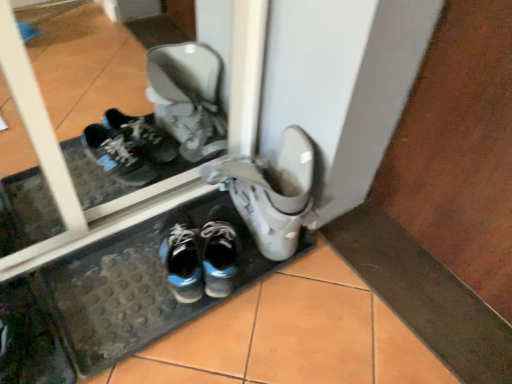
Question: In which direction should I rotate to look at white matte boot at center, which is counted as the first footwear, starting from the right?

Choices:
 (A) left
 (B) right

Answer: (B)

Question: From a real-world perspective, is shiny blue running shoe at center below blue synthetic sneakers at center, positioned as the 2th footwear in right-to-left order?

Choices:
 (A) no
 (B) yes

Answer: (B)

Question: Can you confirm if shiny blue running shoe at center is shorter than blue synthetic sneakers at center, positioned as the 2th footwear in right-to-left order?

Choices:
 (A) no
 (B) yes

Answer: (B)

Question: Are shiny blue running shoe at center and blue synthetic sneakers at center, which is counted as the first footwear, starting from the left, located far from each other?

Choices:
 (A) yes
 (B) no

Answer: (B)

Question: Is shiny blue running shoe at center wider than blue synthetic sneakers at center, which is counted as the first footwear, starting from the left?

Choices:
 (A) no
 (B) yes

Answer: (A)

Question: From a real-world perspective, does shiny blue running shoe at center stand above blue synthetic sneakers at center, which is counted as the first footwear, starting from the left?

Choices:
 (A) no
 (B) yes

Answer: (A)

Question: Is shiny blue running shoe at center closer to camera compared to blue synthetic sneakers at center, positioned as the 2th footwear in right-to-left order?

Choices:
 (A) yes
 (B) no

Answer: (A)

Question: Are blue synthetic sneakers at center, which is counted as the first footwear, starting from the left, and white matte boot at center, which is counted as the first footwear, starting from the right, making contact?

Choices:
 (A) yes
 (B) no

Answer: (B)

Question: Is blue synthetic sneakers at center, which is counted as the first footwear, starting from the left, shorter than white matte boot at center, which is counted as the first footwear, starting from the right?

Choices:
 (A) no
 (B) yes

Answer: (B)

Question: Is blue synthetic sneakers at center, positioned as the 2th footwear in right-to-left order, outside of white matte boot at center, which is counted as the first footwear, starting from the right?

Choices:
 (A) no
 (B) yes

Answer: (B)

Question: Considering the relative sizes of blue synthetic sneakers at center, positioned as the 2th footwear in right-to-left order, and white matte boot at center, the 2th footwear viewed from the left, in the image provided, is blue synthetic sneakers at center, positioned as the 2th footwear in right-to-left order, bigger than white matte boot at center, the 2th footwear viewed from the left,?

Choices:
 (A) no
 (B) yes

Answer: (A)

Question: Does blue synthetic sneakers at center, positioned as the 2th footwear in right-to-left order, have a smaller size compared to white matte boot at center, the 2th footwear viewed from the left?

Choices:
 (A) no
 (B) yes

Answer: (B)

Question: Is blue synthetic sneakers at center, positioned as the 2th footwear in right-to-left order, at the right side of white matte boot at center, which is counted as the first footwear, starting from the right?

Choices:
 (A) no
 (B) yes

Answer: (A)

Question: From a real-world perspective, does blue synthetic sneakers at center, which is counted as the first footwear, starting from the left, sit lower than shiny blue running shoe at center?

Choices:
 (A) no
 (B) yes

Answer: (A)